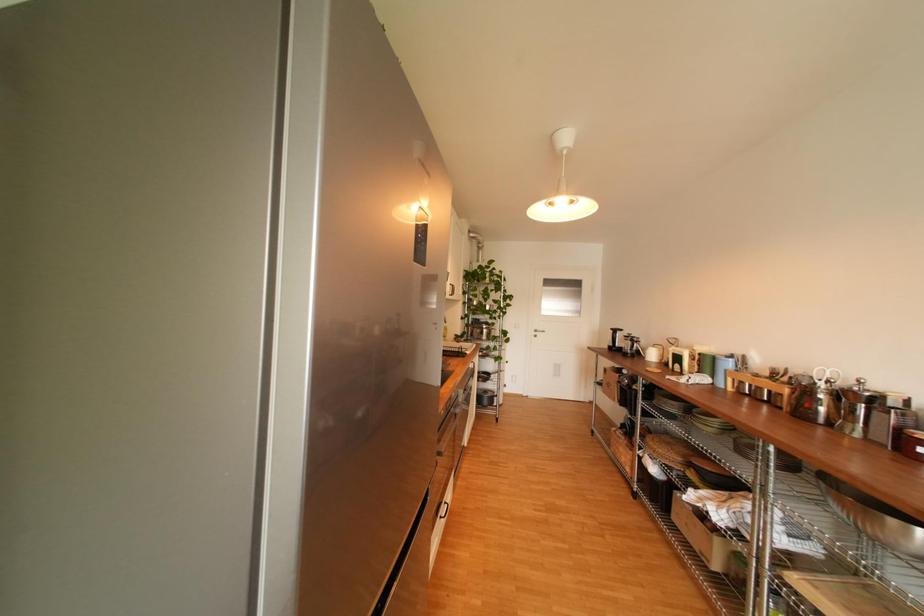
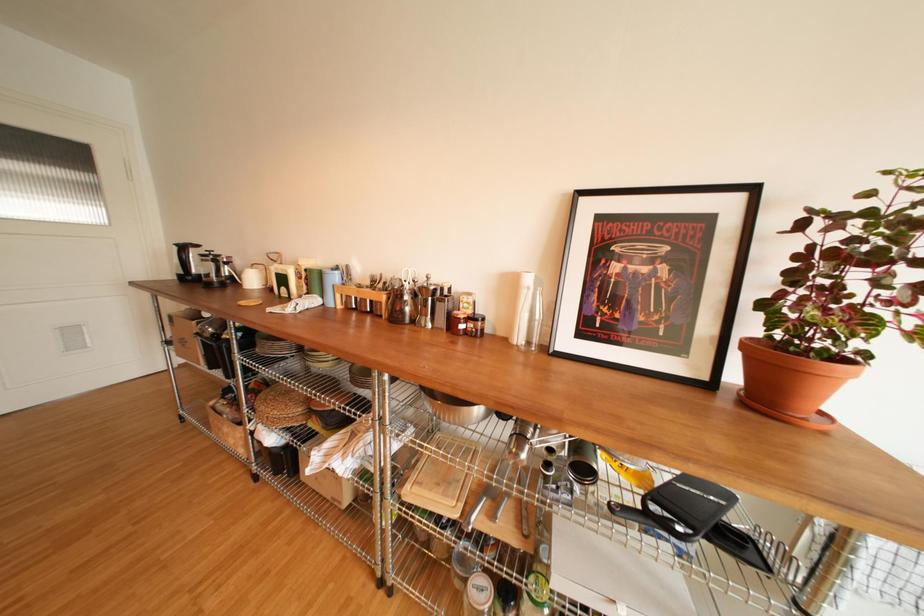
Based on the continuous images, in which direction is the camera rotating?

The camera's rotation is toward right-down.